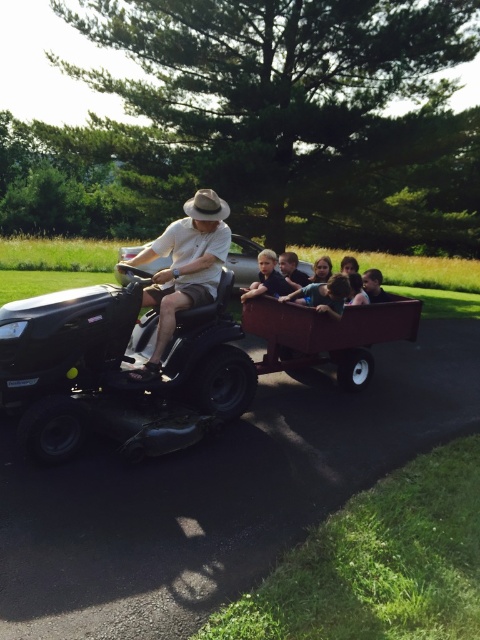
Question: Which of the following is the farthest from the observer?

Choices:
 (A) (262, 262)
 (B) (408, 323)

Answer: (B)

Question: Among these objects, which one is nearest to the camera?

Choices:
 (A) rustic wood wagon at center
 (B) smooth brown hair at center

Answer: (A)

Question: Among these objects, which one is nearest to the camera?

Choices:
 (A) matte black shirt at center
 (B) smooth wooden wagon at center

Answer: (A)

Question: Is rustic wood wagon at center positioned behind matte white shirt at center?

Choices:
 (A) no
 (B) yes

Answer: (B)

Question: From the image, what is the correct spatial relationship of matte black shirt at center in relation to smooth brown hair at center?

Choices:
 (A) left
 (B) right

Answer: (A)

Question: Considering the relative positions of matte white shirt at center and smooth brown hair at center in the image provided, where is matte white shirt at center located with respect to smooth brown hair at center?

Choices:
 (A) left
 (B) right

Answer: (A)